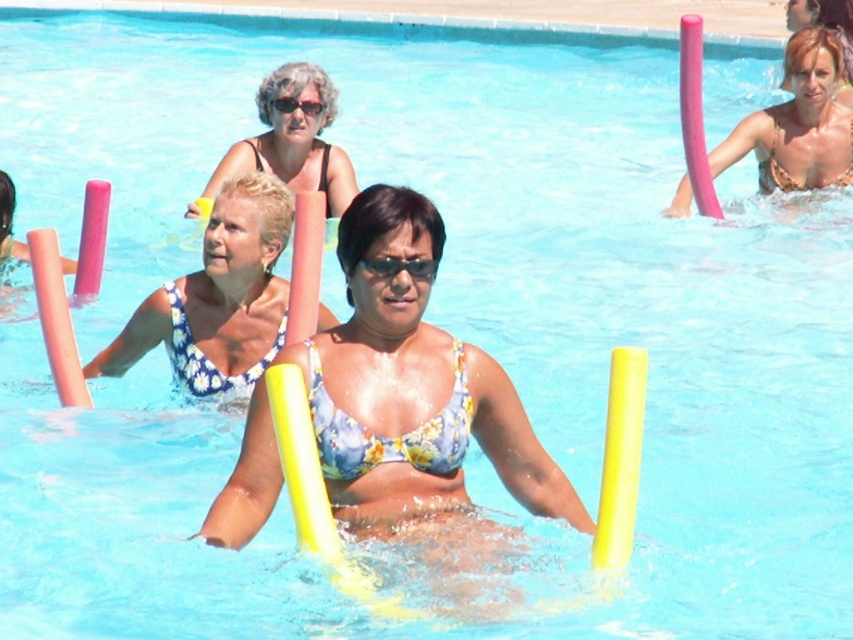
Looking at this image, how far apart are floral bikini top at center and pink foam float at upper right?

floral bikini top at center is 22.76 feet from pink foam float at upper right.

Can you confirm if floral bikini top at center is shorter than pink foam float at upper right?

Correct, floral bikini top at center is not as tall as pink foam float at upper right.

Identify the location of floral bikini top at center. The height and width of the screenshot is (640, 853). (218, 298).

Locate an element on the screen. floral bikini top at center is located at coordinates (218, 298).

Between pink foam float at upper right and black plastic goggles at upper center, which one is positioned higher?

Positioned higher is pink foam float at upper right.

Which is behind, point (801, 100) or point (306, 113)?

Positioned behind is point (801, 100).

Measure the distance between pink foam float at upper right and camera.

They are 43.77 feet apart.

This screenshot has height=640, width=853. Identify the location of pink foam float at upper right. (796, 124).

Between floral bikini top at center and pink foam float at left, which one has more height?

Standing taller between the two is floral bikini top at center.

Can you confirm if floral bikini top at center is bigger than pink foam float at left?

Correct, floral bikini top at center is larger in size than pink foam float at left.

Locate an element on the screen. The height and width of the screenshot is (640, 853). floral bikini top at center is located at coordinates (218, 298).